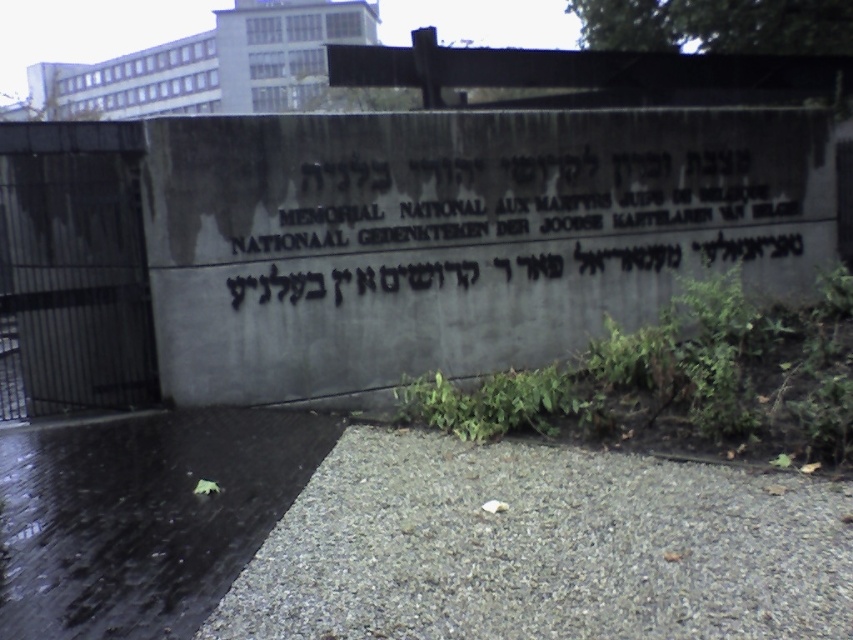
Based on the photo, does dark gray stone sign at center have a lesser height compared to green leafy plant at lower right?

No, dark gray stone sign at center is not shorter than green leafy plant at lower right.

Can you confirm if dark gray stone sign at center is positioned below green leafy plant at lower right?

No.

Who is more distant from viewer, (340, 168) or (781, 355)?

The point (340, 168) is more distant.

Identify the location of dark gray stone sign at center. Image resolution: width=853 pixels, height=640 pixels. (511, 220).